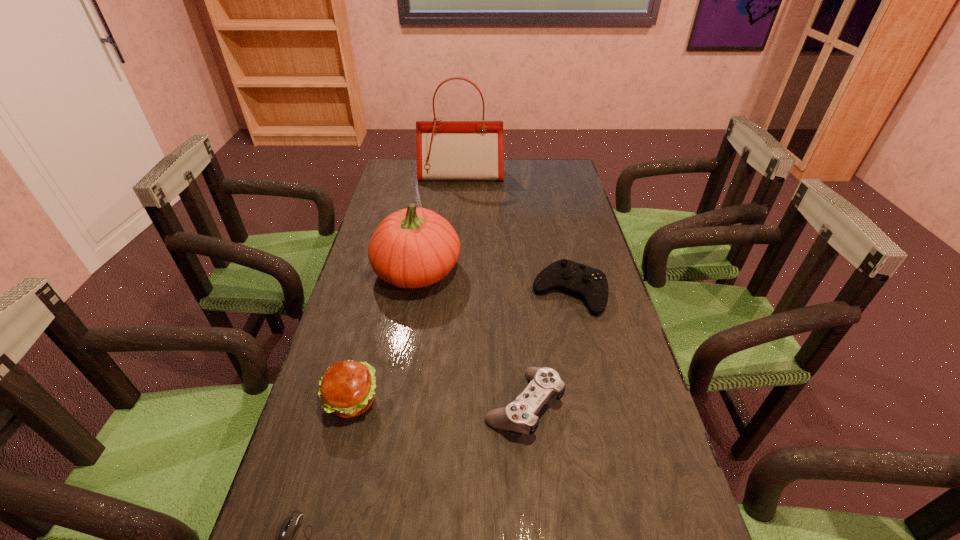
I want to click on vacant space positioned 0.270m on the back of the nearer control, so click(x=515, y=294).

Find the location of `object that is at the far edge`. object that is at the far edge is located at coordinates (446, 150).

Identify the location of handbag present at the left edge. (446, 150).

Where is `pumpkin positioned at the left edge`? The height and width of the screenshot is (540, 960). pumpkin positioned at the left edge is located at coordinates (414, 247).

Locate an element on the screen. This screenshot has width=960, height=540. hamburger that is positioned at the left edge is located at coordinates (347, 388).

This screenshot has height=540, width=960. In order to click on object at the right edge in this screenshot , I will do `click(591, 284)`.

The width and height of the screenshot is (960, 540). I want to click on object that is at the far left corner, so click(446, 150).

In the image, there is a desktop. Where is `vacant space at the far edge`? Image resolution: width=960 pixels, height=540 pixels. vacant space at the far edge is located at coordinates (430, 187).

This screenshot has width=960, height=540. What are the coordinates of `blank space at the left edge` in the screenshot? It's located at (287, 488).

Find the location of a particular element. This screenshot has width=960, height=540. vacant position at the right edge of the desktop is located at coordinates (567, 202).